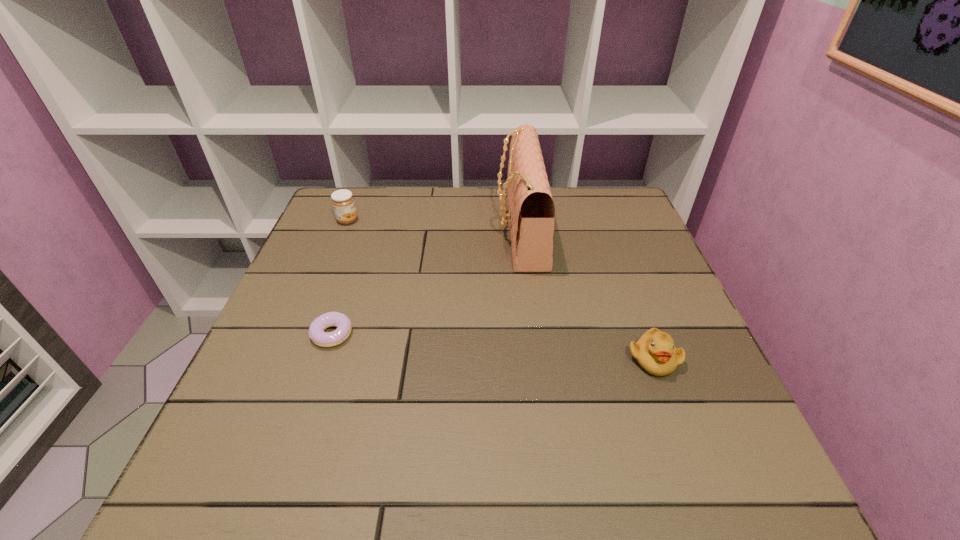
Image resolution: width=960 pixels, height=540 pixels. Identify the location of vacant region located 0.140m on the right of the shortest object. point(420,334).

The height and width of the screenshot is (540, 960). In order to click on handbag situated at the far edge in this screenshot , I will do `click(531, 208)`.

Identify the location of jam located at the far edge. (343, 203).

Locate an element on the screen. This screenshot has width=960, height=540. jam positioned at the left edge is located at coordinates (343, 203).

The image size is (960, 540). I want to click on doughnut that is at the left edge, so click(316, 333).

Locate an element on the screen. This screenshot has width=960, height=540. object that is at the right edge is located at coordinates (655, 352).

Find the location of a particular element. This screenshot has width=960, height=540. object that is at the far left corner is located at coordinates [x=343, y=203].

This screenshot has height=540, width=960. What are the coordinates of `vacant space at the far edge of the desktop` in the screenshot? It's located at (471, 224).

Image resolution: width=960 pixels, height=540 pixels. I want to click on free region at the left edge of the desktop, so click(279, 436).

The height and width of the screenshot is (540, 960). I want to click on vacant space at the right edge of the desktop, so tap(678, 418).